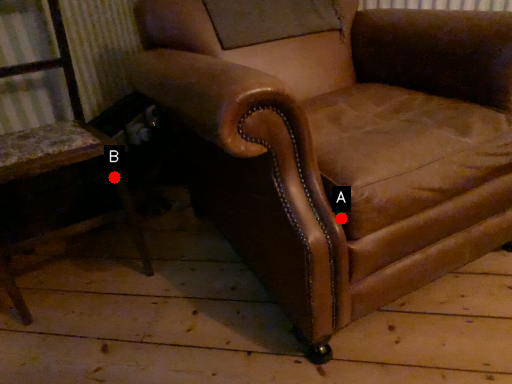
Question: Two points are circled on the image, labeled by A and B beside each circle. Which point is closer to the camera taking this photo?

Choices:
 (A) A is closer
 (B) B is closer

Answer: (A)